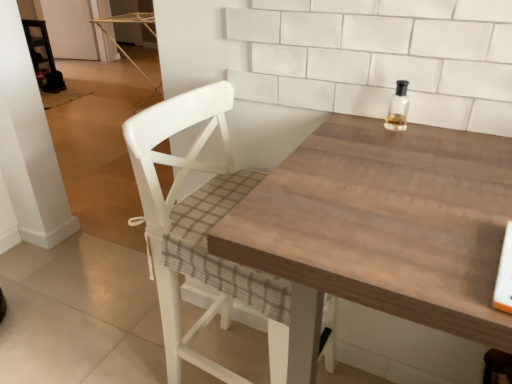
The width and height of the screenshot is (512, 384). What are the coordinates of `vacant space situated on the left part of clear glass bottle at upper right` in the screenshot? It's located at tap(346, 132).